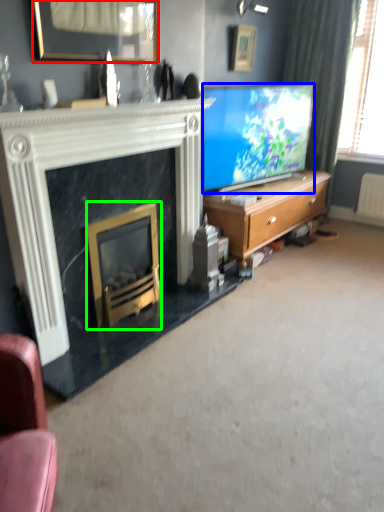
Question: Which object is positioned closest to picture frame (highlighted by a red box)? Select from television (highlighted by a blue box) and fireplace (highlighted by a green box).

Choices:
 (A) television
 (B) fireplace

Answer: (B)